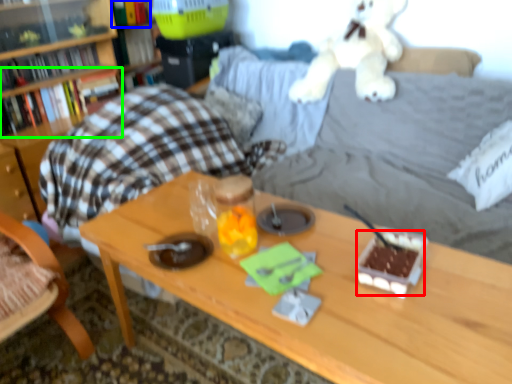
Question: Which is farther away from food (highlighted by a red box)? book (highlighted by a blue box) or book (highlighted by a green box)?

Choices:
 (A) book
 (B) book

Answer: (A)